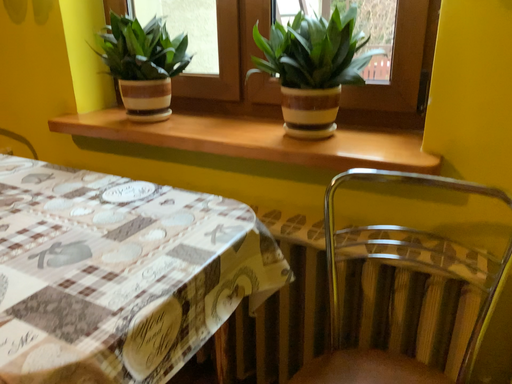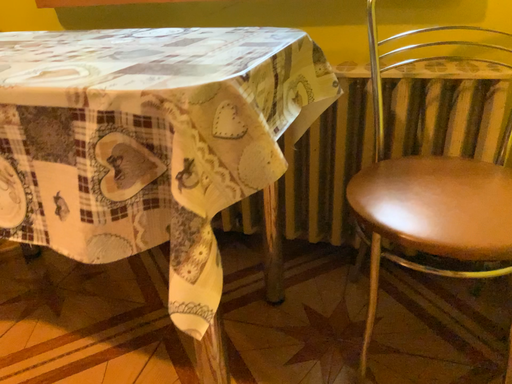
Question: Which way did the camera rotate in the video?

Choices:
 (A) rotated left
 (B) rotated right

Answer: (B)